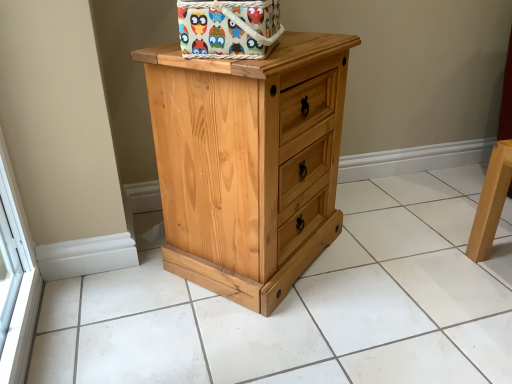
Question: From the image's perspective, relative to multicolored fabric basket at top center, is natural wood chest of drawers at center above or below?

Choices:
 (A) below
 (B) above

Answer: (A)

Question: Looking at their shapes, would you say natural wood chest of drawers at center is wider or thinner than multicolored fabric basket at top center?

Choices:
 (A) wide
 (B) thin

Answer: (A)

Question: Which object is the farthest from the multicolored fabric basket at top center?

Choices:
 (A) natural wood cabinet at center
 (B) natural wood chest of drawers at center

Answer: (A)

Question: Which object is the farthest from the multicolored fabric basket at top center?

Choices:
 (A) natural wood chest of drawers at center
 (B) natural wood cabinet at center

Answer: (B)